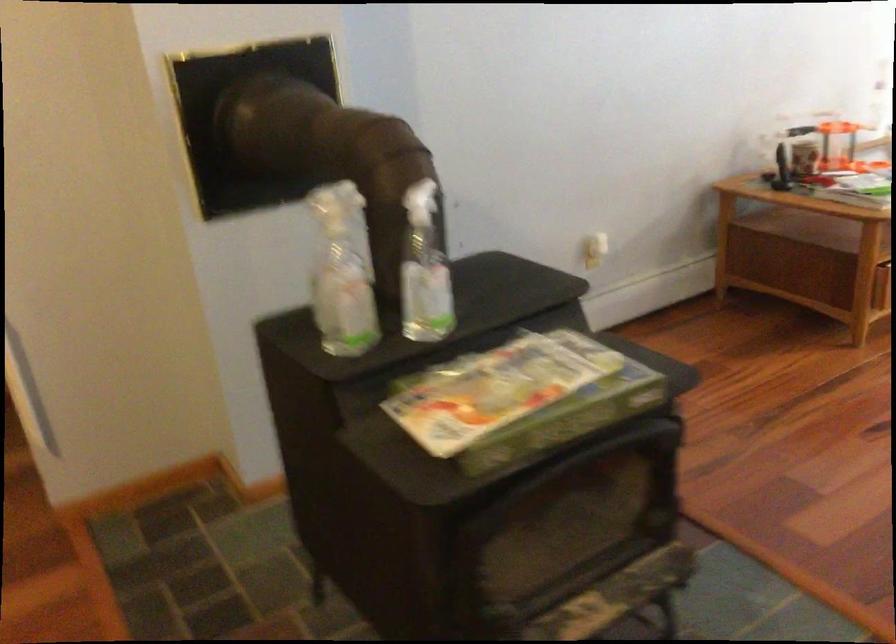
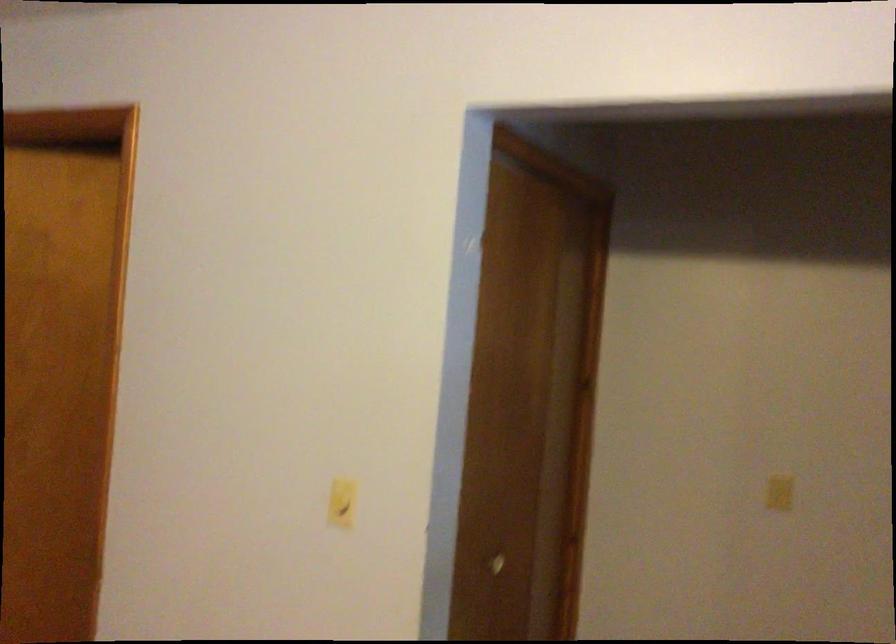
Question: The camera is either moving clockwise (left) or counter-clockwise (right) around the object. The first image is from the beginning of the video and the second image is from the end. Is the camera moving left or right when shooting the video?

Choices:
 (A) Left
 (B) Right

Answer: (B)